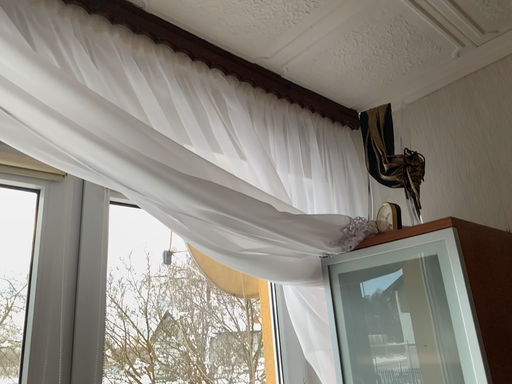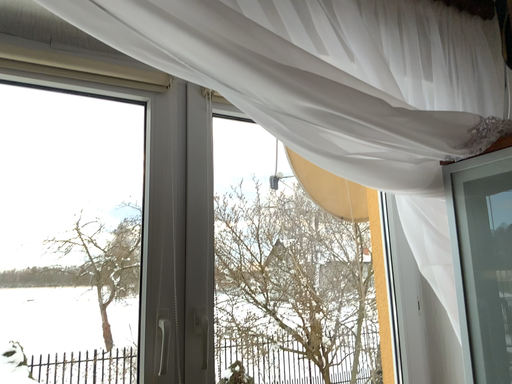
Question: How did the camera likely rotate when shooting the video?

Choices:
 (A) rotated right
 (B) rotated left

Answer: (B)